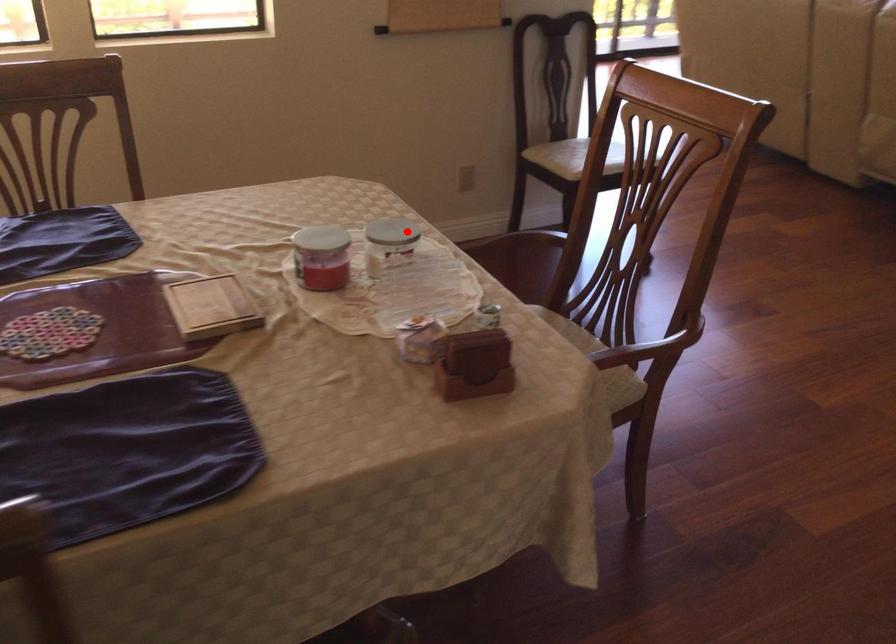
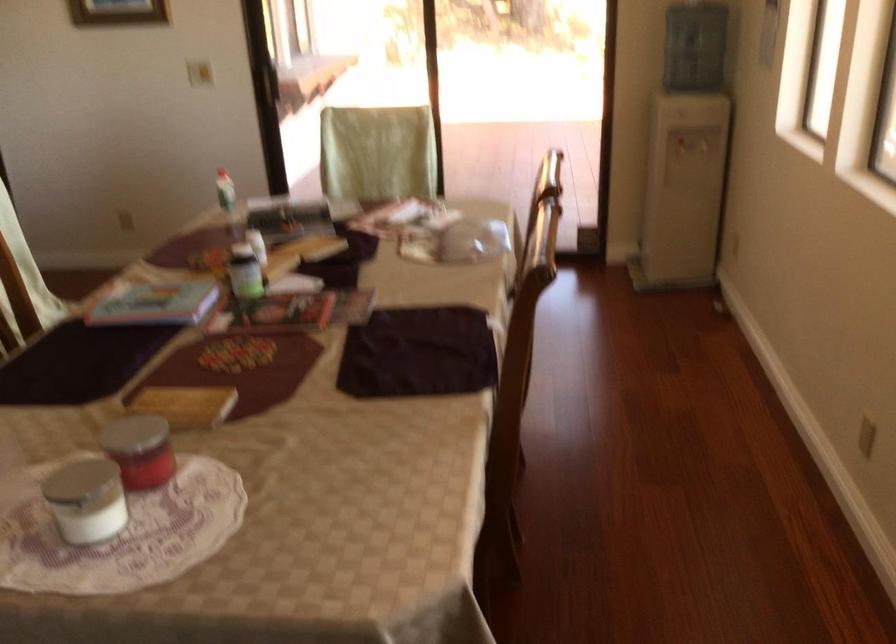
In the second image, find the point that corresponds to the highlighted location in the first image.

(85, 500)